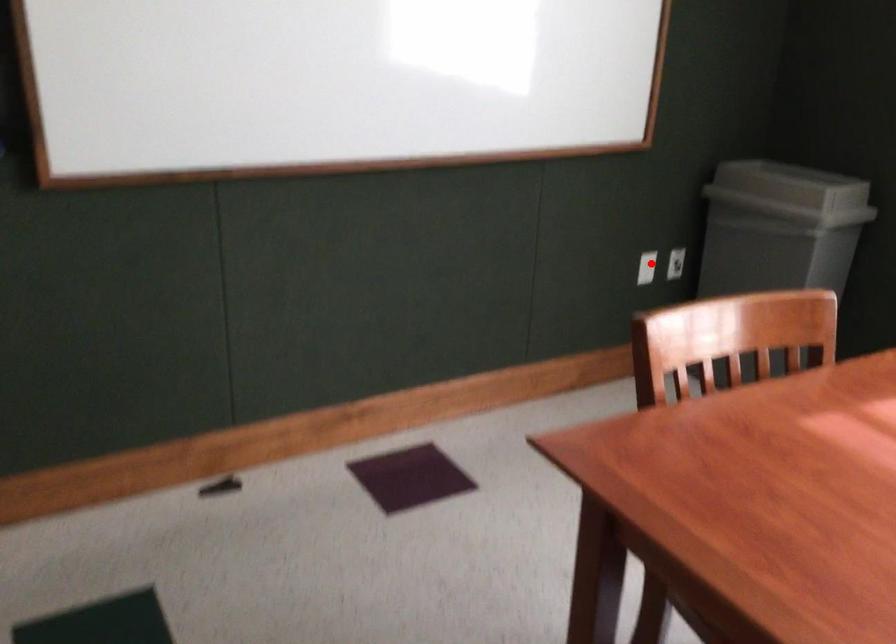
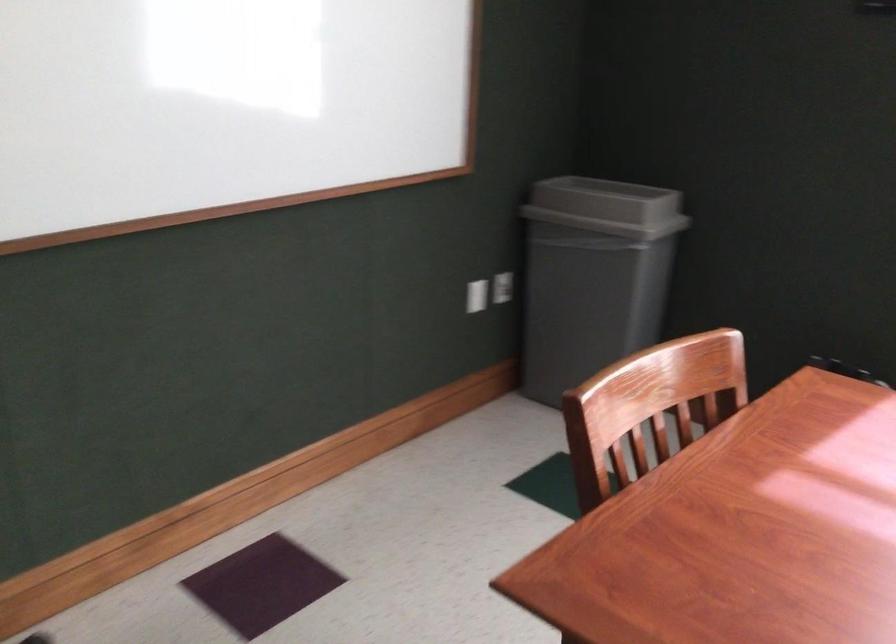
Where in the second image is the point corresponding to the highlighted location from the first image?

(477, 295)